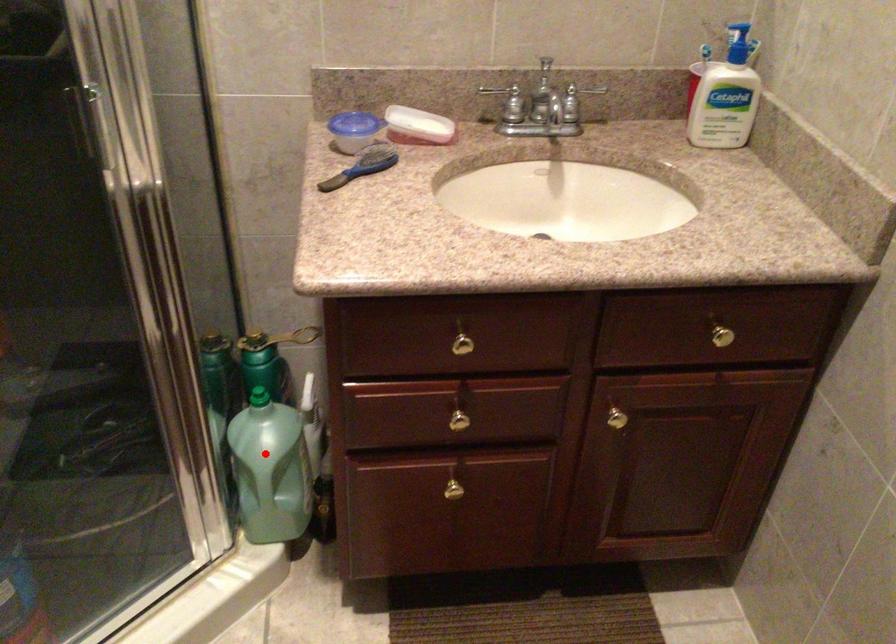
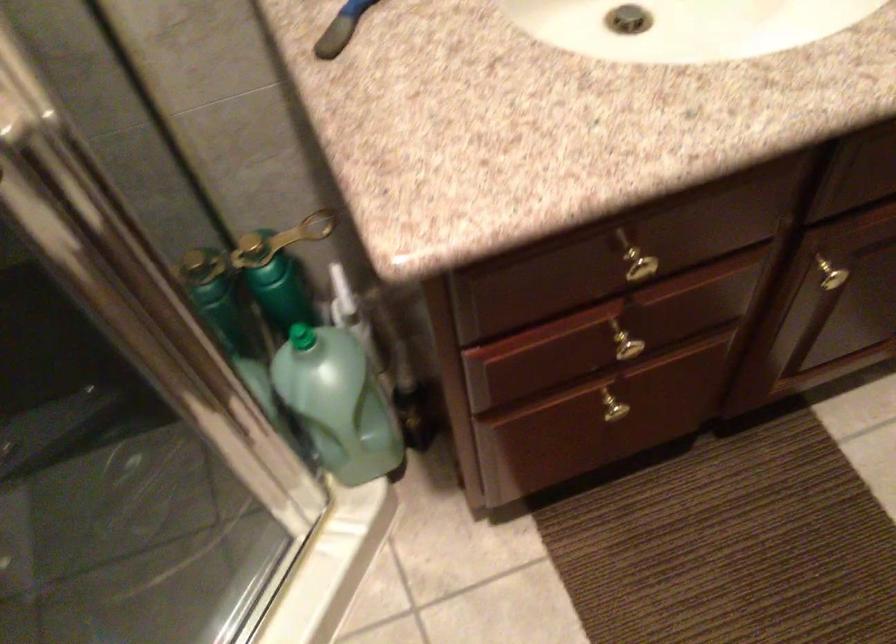
Question: I am providing you with two images of the same scene from different viewpoints. A red point is shown in image1. For the corresponding object point in image2, is it positioned nearer or farther from the camera?

Choices:
 (A) Nearer
 (B) Farther

Answer: (A)